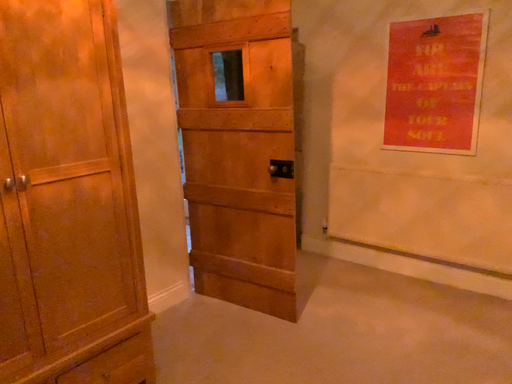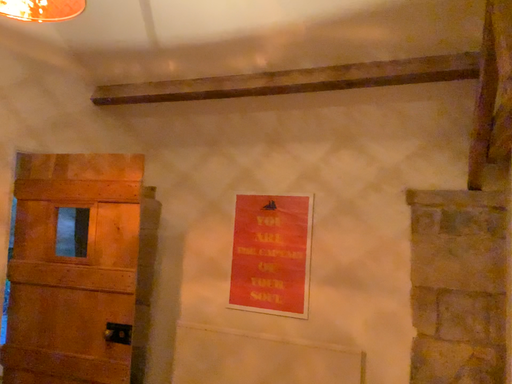
Question: How did the camera likely rotate when shooting the video?

Choices:
 (A) rotated downward
 (B) rotated upward

Answer: (B)